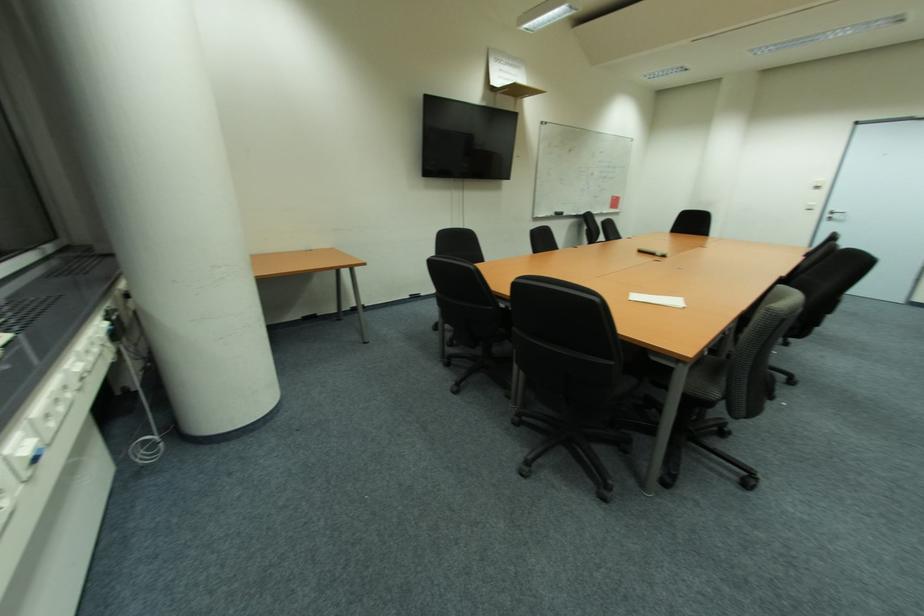
I want to click on silver door handle, so click(835, 215).